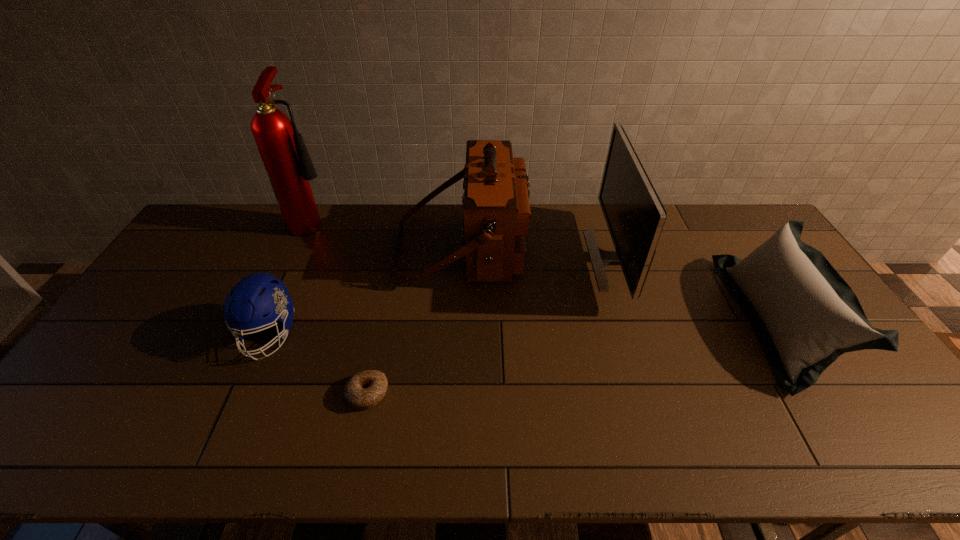
The height and width of the screenshot is (540, 960). Identify the location of vacant region that satisfies the following two spatial constraints: 1. on the face side of the satchel; 2. on the face guard of the football helmet. (458, 334).

In order to click on free spot that satisfies the following two spatial constraints: 1. on the back side of the shortest object; 2. at the nozzle of the fire extinguisher in this screenshot , I will do `click(403, 220)`.